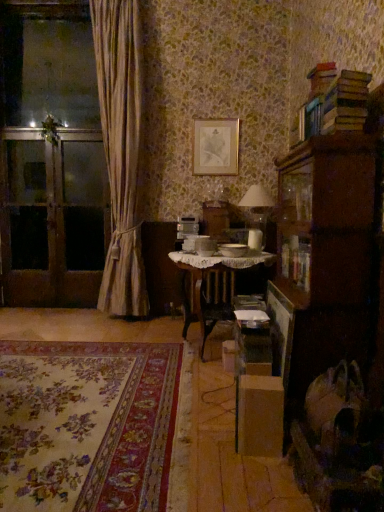
Question: Would you say white matte table lamp at center is to the left or to the right of hardcover books at upper right in the picture?

Choices:
 (A) left
 (B) right

Answer: (A)

Question: From the image's perspective, relative to hardcover books at upper right, is white matte table lamp at center above or below?

Choices:
 (A) below
 (B) above

Answer: (A)

Question: Which object is positioned farthest from the velvet dark brown swivel chair at lower right?

Choices:
 (A) silky beige curtain at left
 (B) transparent glass screen door at left, which appears as the first screen door when viewed from the right
 (C) gold metallic picture frame at upper center
 (D) hardcover books at upper right
 (E) white matte table lamp at center

Answer: (B)

Question: Which of these objects is positioned farthest from the floral carpet at lower left?

Choices:
 (A) brown wooden screen door at left, the 1th screen door from the left
 (B) white matte table lamp at center
 (C) wooden cabinet at right
 (D) gold metallic picture frame at upper center
 (E) hardcover books at upper right

Answer: (D)